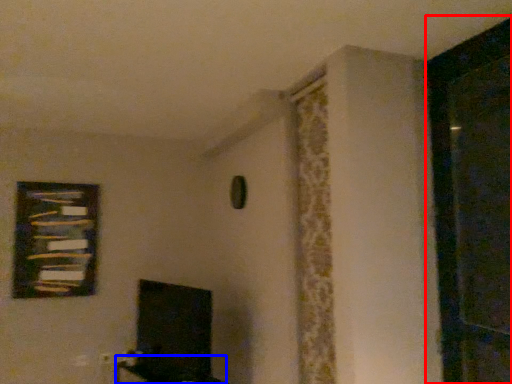
Question: Which object is further to the camera taking this photo, screen door (highlighted by a red box) or furniture (highlighted by a blue box)?

Choices:
 (A) screen door
 (B) furniture

Answer: (B)